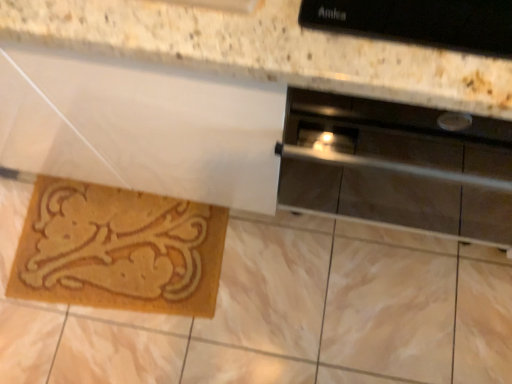
Find the location of a particular element. The width and height of the screenshot is (512, 384). vacant area located to the right-hand side of natural fiber mat at lower left is located at coordinates (281, 291).